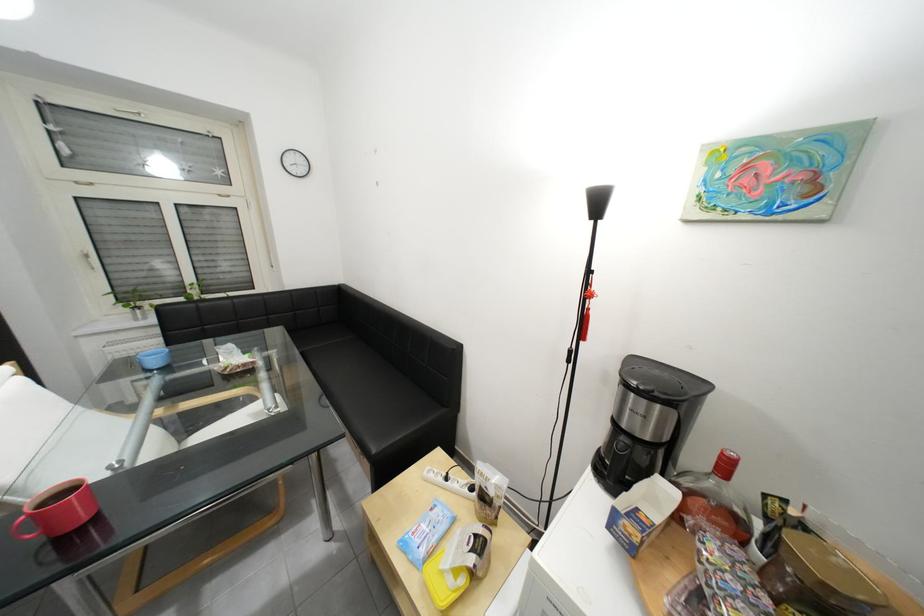
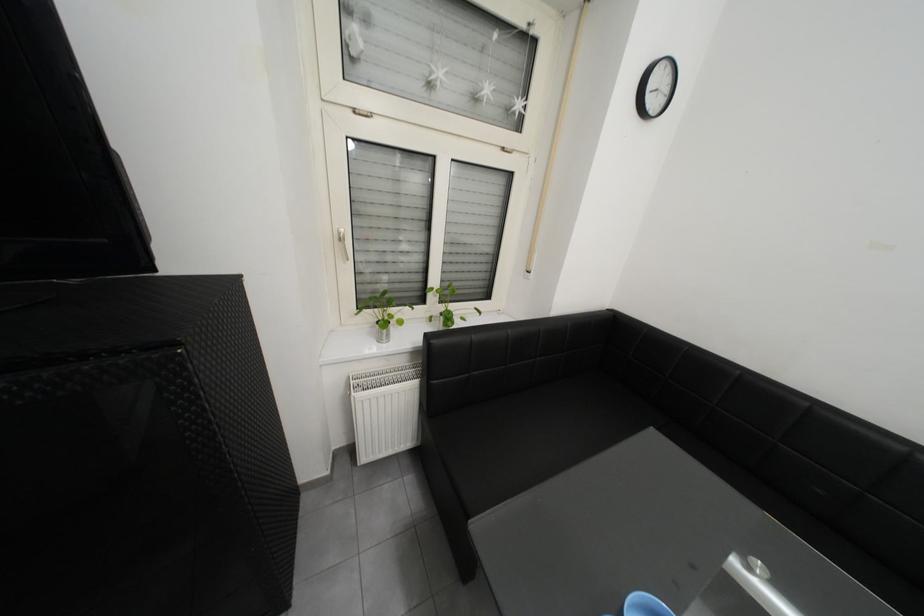
Which direction would the cameraman need to move to produce the second image?

The cameraman walked toward left, forward.